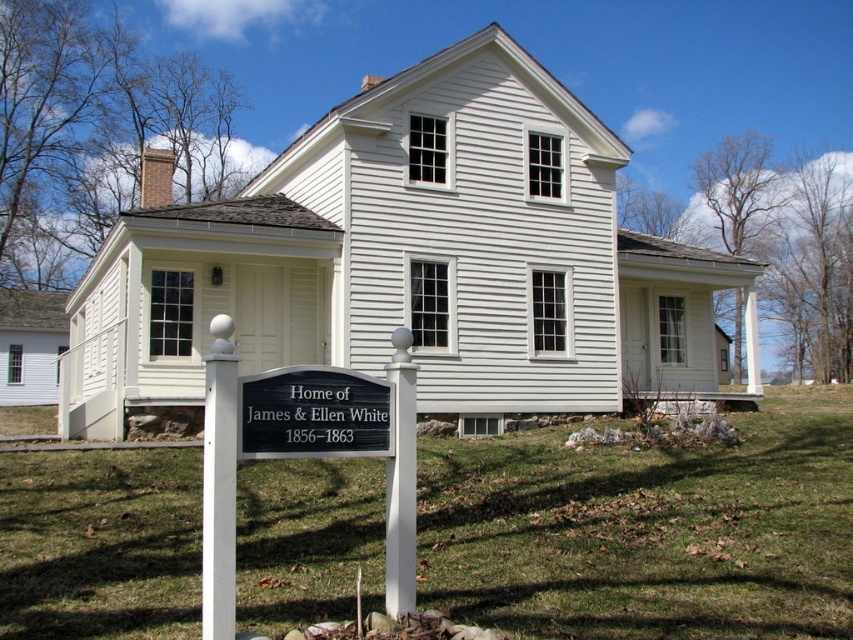
You are standing in front of the house and want to take a photo that includes both the white siding house at center and the sign mounted on two white posts. The camera you are using has a maximum focus range of 15 meters. Can you capture both the house and the sign in the same photo without moving your position?

The white siding house at center is 13.18 meters away from the viewer. Since the sign is mounted in front of the house, it is closer than 13.18 meters. The camera can focus up to 15 meters, so both the house and the sign are within the focus range. Therefore, you can capture both in the same photo.

You are standing in front of the house and want to place a new flowerpot exactly at the center of the white siding house at center. According to the coordinates provided, where should you place the flowerpot?

The flowerpot should be placed at the coordinates point (410, 260), which is the center of the white siding house at center.